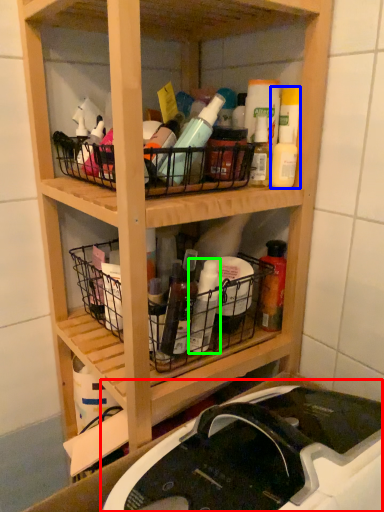
Question: Which object is the closest to the sink (highlighted by a red box)? Choose among these: cleaning product (highlighted by a blue box) or bottle (highlighted by a green box).

Choices:
 (A) cleaning product
 (B) bottle

Answer: (B)